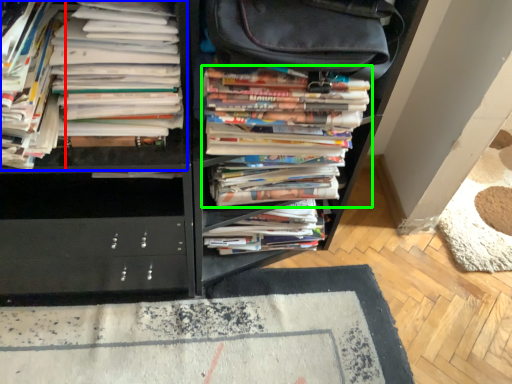
Question: Considering the real-world distances, which object is farthest from book (highlighted by a red box)? book (highlighted by a blue box) or book (highlighted by a green box)?

Choices:
 (A) book
 (B) book

Answer: (B)